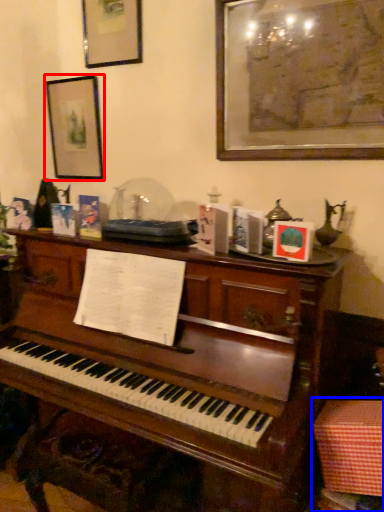
Question: Which object is further to the camera taking this photo, picture frame (highlighted by a red box) or table (highlighted by a blue box)?

Choices:
 (A) picture frame
 (B) table

Answer: (A)